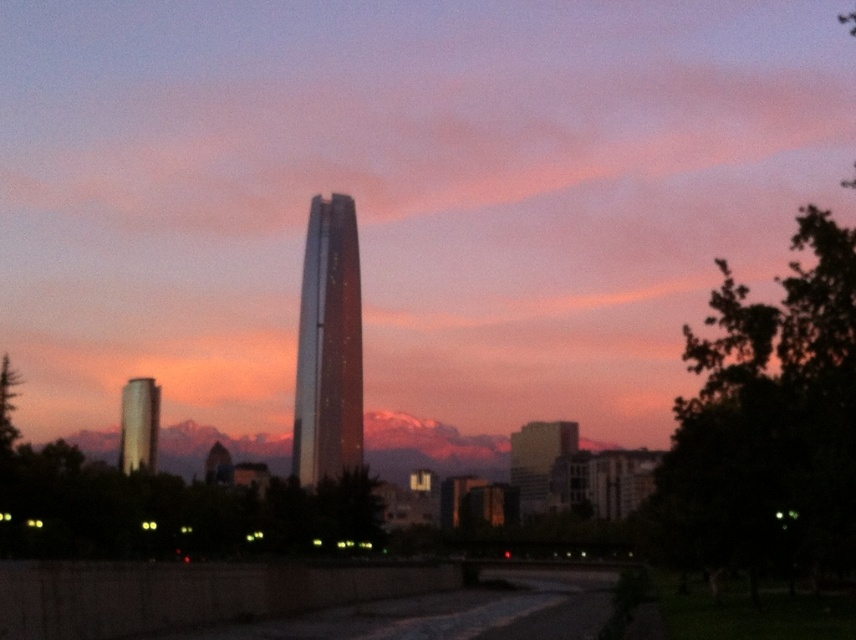
Question: Does glossy glass tower at center lie behind shiny glass tower at center?

Choices:
 (A) yes
 (B) no

Answer: (B)

Question: Is glossy glass tower at center to the right of shiny silver tower at left from the viewer's perspective?

Choices:
 (A) no
 (B) yes

Answer: (B)

Question: Which object appears farthest from the camera in this image?

Choices:
 (A) shiny silver tower at left
 (B) smooth glass building at center

Answer: (A)

Question: Can you confirm if glossy glass tower at center is wider than shiny silver tower at left?

Choices:
 (A) no
 (B) yes

Answer: (B)

Question: Which of the following is the farthest from the observer?

Choices:
 (A) (117, 337)
 (B) (513, 440)
 (C) (131, 470)

Answer: (A)

Question: Which point is closer to the camera taking this photo?

Choices:
 (A) (129, 468)
 (B) (366, 346)
 (C) (336, 372)

Answer: (C)